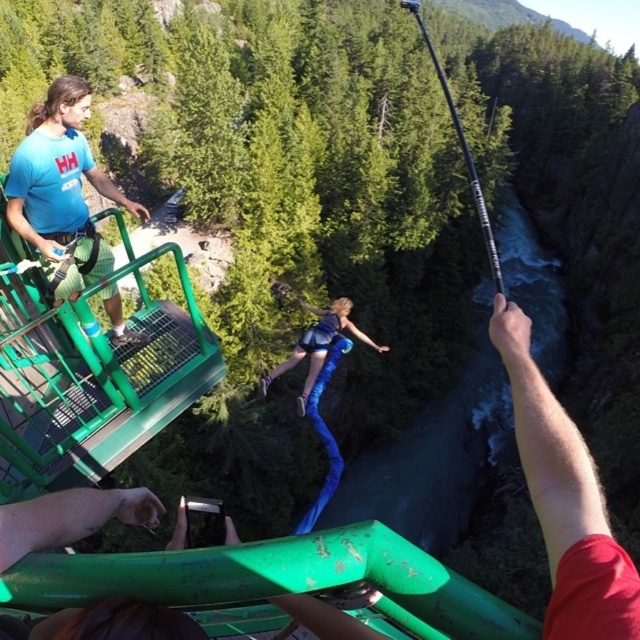
Question: Among these objects, which one is nearest to the camera?

Choices:
 (A) blue fabric at center
 (B) blue t-shirt at left

Answer: (B)

Question: Can you confirm if blue t-shirt at left is bigger than blue fabric at center?

Choices:
 (A) yes
 (B) no

Answer: (B)

Question: From the image, what is the correct spatial relationship of blue t-shirt at left in relation to blue fabric at center?

Choices:
 (A) right
 (B) left

Answer: (B)

Question: Does blue t-shirt at left have a larger size compared to blue fabric at center?

Choices:
 (A) yes
 (B) no

Answer: (B)